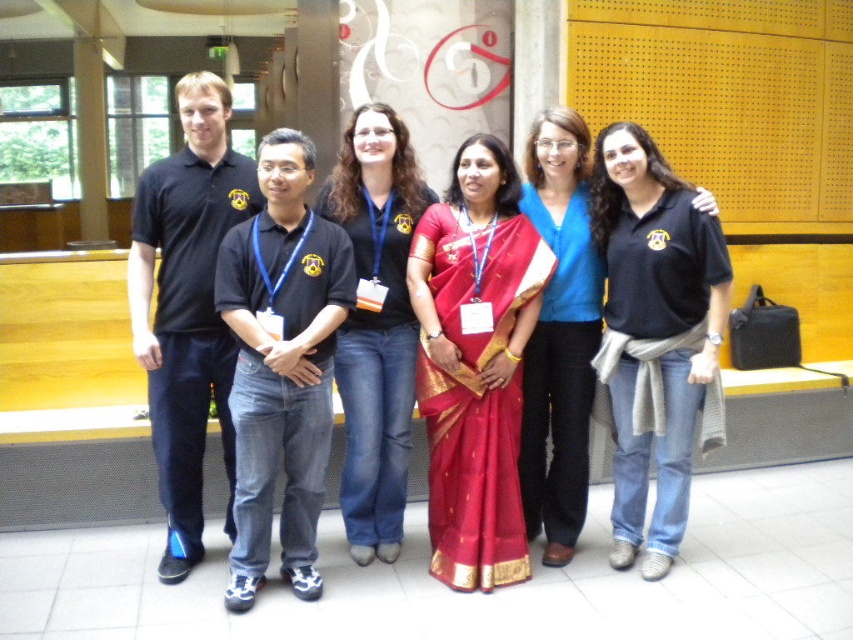
Question: Is black cotton shirt at center to the right of black cotton polo shirt at center from the viewer's perspective?

Choices:
 (A) no
 (B) yes

Answer: (A)

Question: Which of the following is the closest to the observer?

Choices:
 (A) silky red sari at center
 (B) black cotton shirt at center

Answer: (A)

Question: Which object is positioned farthest from the black cotton shirt at center?

Choices:
 (A) black cotton polo shirt at left
 (B) silky red sari at center
 (C) black cotton polo shirt at center

Answer: (C)

Question: Which point is closer to the camera?

Choices:
 (A) black cotton shirt at center
 (B) silky red sari at center

Answer: (B)

Question: Is silky red sari at center below black cotton polo shirt at left?

Choices:
 (A) no
 (B) yes

Answer: (B)

Question: Does black cotton polo shirt at left have a larger size compared to black cotton shirt at center?

Choices:
 (A) no
 (B) yes

Answer: (B)